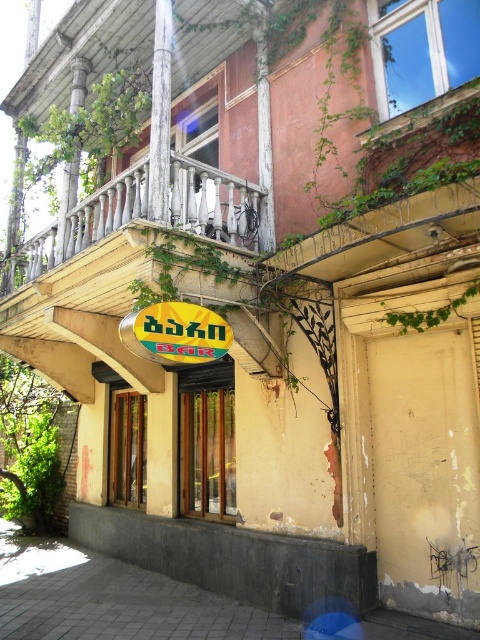
Question: Which of the following is the closest to the observer?

Choices:
 (A) (124, 328)
 (B) (335, 260)

Answer: (A)

Question: Is rusty metal balcony at upper center positioned in front of yellow matte sign at center?

Choices:
 (A) no
 (B) yes

Answer: (B)

Question: Considering the relative positions of rusty metal balcony at upper center and yellow matte sign at center in the image provided, where is rusty metal balcony at upper center located with respect to yellow matte sign at center?

Choices:
 (A) left
 (B) right

Answer: (B)

Question: Among these points, which one is nearest to the camera?

Choices:
 (A) (346, 256)
 (B) (206, 332)

Answer: (A)

Question: Can you confirm if rusty metal balcony at upper center is positioned to the left of yellow matte sign at center?

Choices:
 (A) yes
 (B) no

Answer: (B)